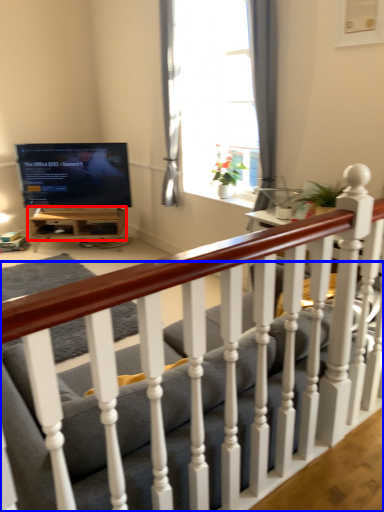
Question: Which of the following is the farthest to the observer, table (highlighted by a red box) or studio couch (highlighted by a blue box)?

Choices:
 (A) table
 (B) studio couch

Answer: (A)